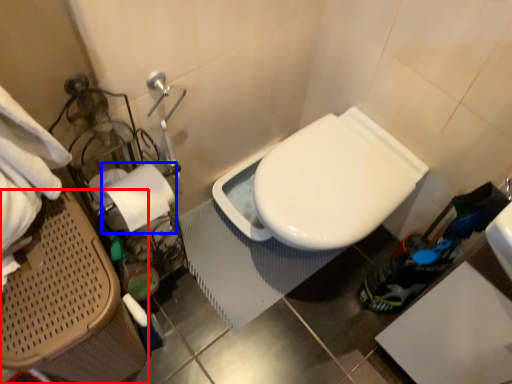
Question: Which object appears farthest to the camera in this image, laundry basket (highlighted by a red box) or toilet paper (highlighted by a blue box)?

Choices:
 (A) laundry basket
 (B) toilet paper

Answer: (B)